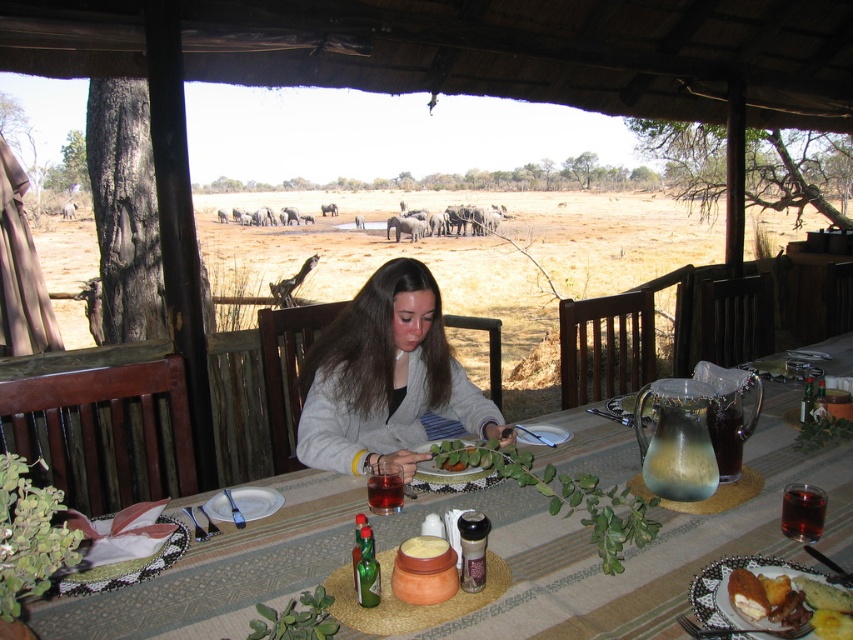
You are setting up a centerpiece for a dinner party and want to place the white ceramic plate at lower left next to the matte glass pitcher at center. Which object should you place first to ensure there is enough space?

You should place the matte glass pitcher at center first because it is larger than the white ceramic plate at lower left, ensuring there is enough space for both items on the table.

You are a guest at this outdoor dining table and want to pour water into your glass. The matte glass pitcher at center and golden brown bread at center are both on the table. Which item is closer to your left hand side?

The matte glass pitcher at center is to the left of golden brown bread at center, so it is closer to your left hand side.